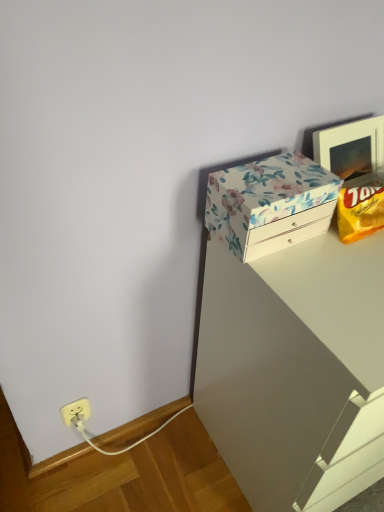
Identify the location of free space in front of floral paper-covered box at upper right. (312, 283).